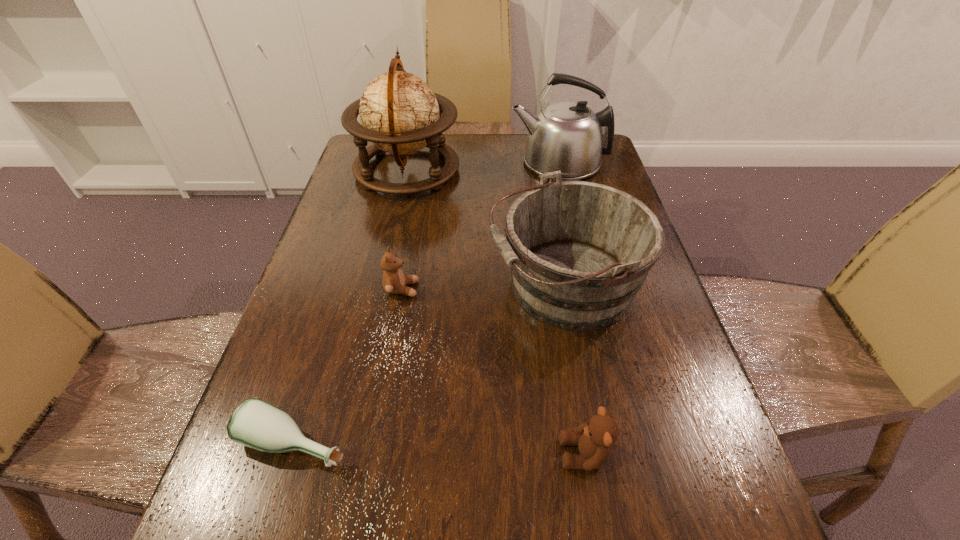
At what (x,y) coordinates should I click in order to perform the action: click on vacant space located on the left of the wine bucket. Please return your answer as a coordinate pair (x, y). The image size is (960, 540). Looking at the image, I should click on (x=324, y=286).

This screenshot has height=540, width=960. What are the coordinates of `vacant space located 0.240m on the front-facing side of the farther teddy bear` in the screenshot? It's located at (527, 289).

Find the location of a particular element. vacant space located 0.390m on the face of the nearer teddy bear is located at coordinates (319, 454).

Locate an element on the screen. free space located 0.370m on the face of the nearer teddy bear is located at coordinates (331, 454).

Identify the location of vacant area situated 0.330m on the face of the nearer teddy bear. This screenshot has height=540, width=960. (356, 454).

What are the coordinates of `free space located 0.110m on the back of the bottle` in the screenshot? It's located at (321, 359).

Identify the location of globe present at the far edge. Image resolution: width=960 pixels, height=540 pixels. (399, 113).

Find the location of a particular element. The height and width of the screenshot is (540, 960). kettle at the far edge is located at coordinates (566, 136).

You are a GUI agent. You are given a task and a screenshot of the screen. Output one action in this format:
    pyautogui.click(x=<x>, y=<y>)
    Task: Click on the globe that is at the left edge
    The height and width of the screenshot is (540, 960).
    Given the screenshot: What is the action you would take?
    pyautogui.click(x=399, y=113)

This screenshot has height=540, width=960. What are the coordinates of `bottle present at the left edge` in the screenshot? It's located at (255, 423).